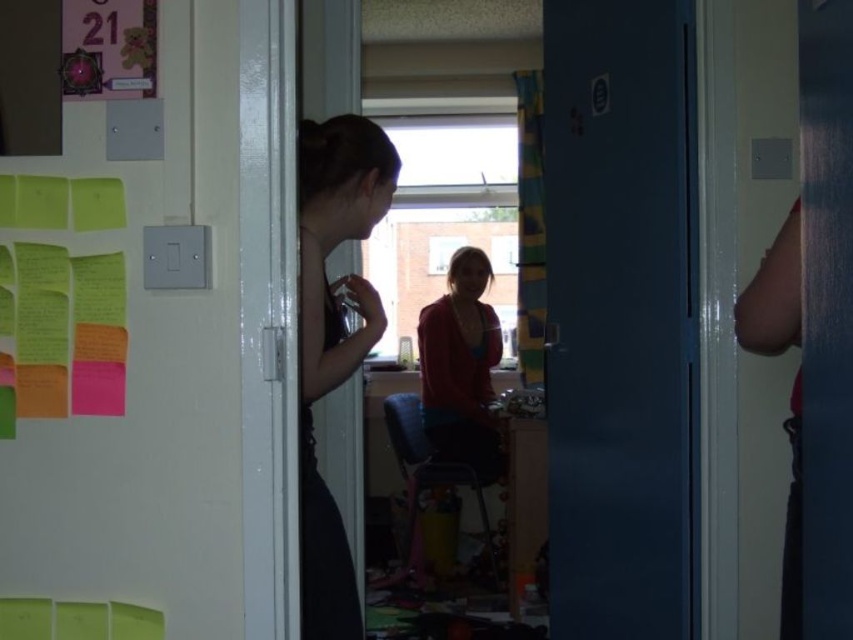
You are standing in the hallway outside the dorm room and want to enter. The door is open, and you see the multicolored sticky notes at left and the matte red sweater at center. Which object is closer to the door when you enter?

The multicolored sticky notes at left are closer to the door when you enter because they are positioned to the left of the matte red sweater at center, which is further into the room.

You are standing in the doorway of the dorm room and see the matte red sweater at center and the green paper at upper left. Which object is closer to the left side of the room?

The green paper at upper left is closer to the left side of the room because it is positioned to the left of the matte red sweater at center.

You are standing in the hallway outside the dorm room and want to enter. You notice the multicolored sticky notes at left and the matte red sweater at center. Which object is closer to the door?

The multicolored sticky notes at left are closer to the door because they are closer to the viewer than the matte red sweater at center, and since you are outside looking in, the closer objects would be near the door.